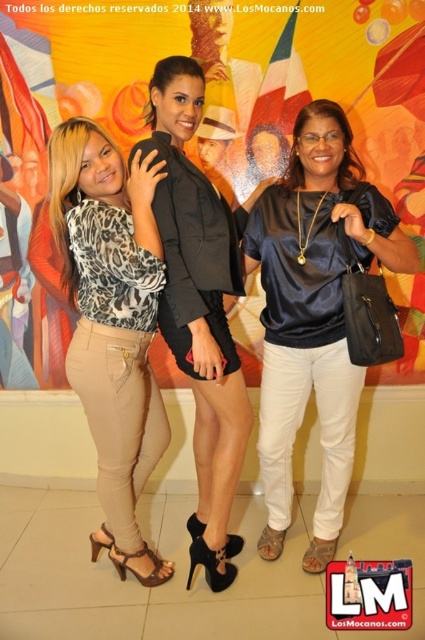
You are a photographer trying to capture a closeup shot of the matte black blazer at center and the satin black blouse at center. Which one should you focus on if you want to frame the wider object?

The matte black blazer at center is wider than the satin black blouse at center, so you should focus on the matte black blazer at center to frame the wider object.

You are a photographer trying to adjust the lighting for a shoot. You notice the matte black blazer at center and the satin black blouse at center in the image. Which of these two items might reflect more light, and why?

The satin black blouse at center would reflect more light because satin fabric typically has a smoother surface compared to the matte black blazer at center, which has a non reflective finish. However, both are black, so the difference in reflectivity might be subtle.